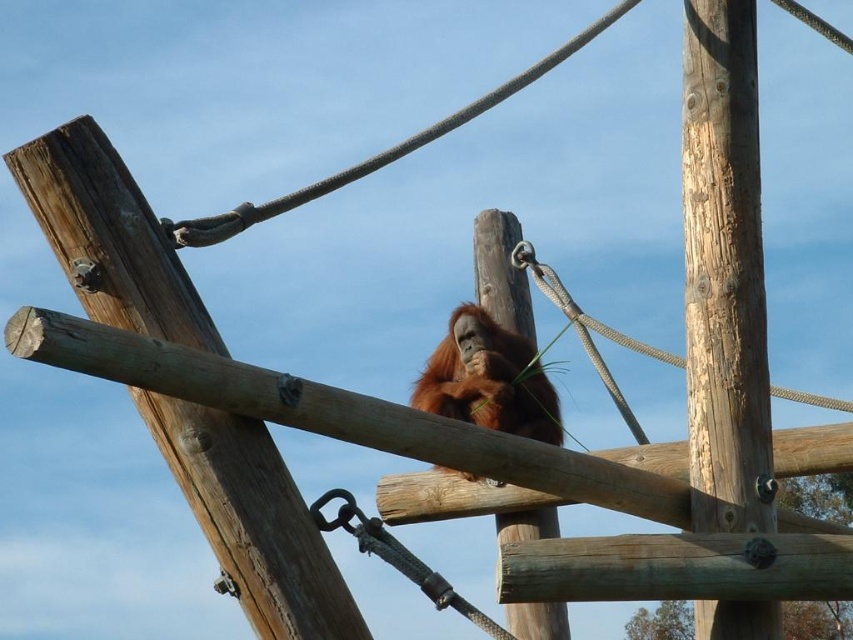
Consider the image. You are an orangutan trainer planning to place a treat on the pole that takes up more space. Which pole should you choose between the rustic wood pole at center and the smooth wood pole at center?

The smooth wood pole at center occupies more space than the rustic wood pole at center, so you should place the treat on the smooth wood pole at center.

You are an orangutan trying to reach a banana placed on the smooth wood pole at center. You are currently on the rustic wood pole at center. Which direction should you move to reach the banana?

The smooth wood pole at center is further away from you than the rustic wood pole at center. To reach the banana on the smooth wood pole at center, you need to move forward away from the viewer.

You are standing in front of an orangutan enclosure and want to throw a banana to the orangutan at point [688,97]. The banana can travel 100 feet. Will it reach the orangutan?

The point [688,97] is 109.18 feet away from the viewer, which is farther than the banana can travel. The banana will not reach the orangutan.